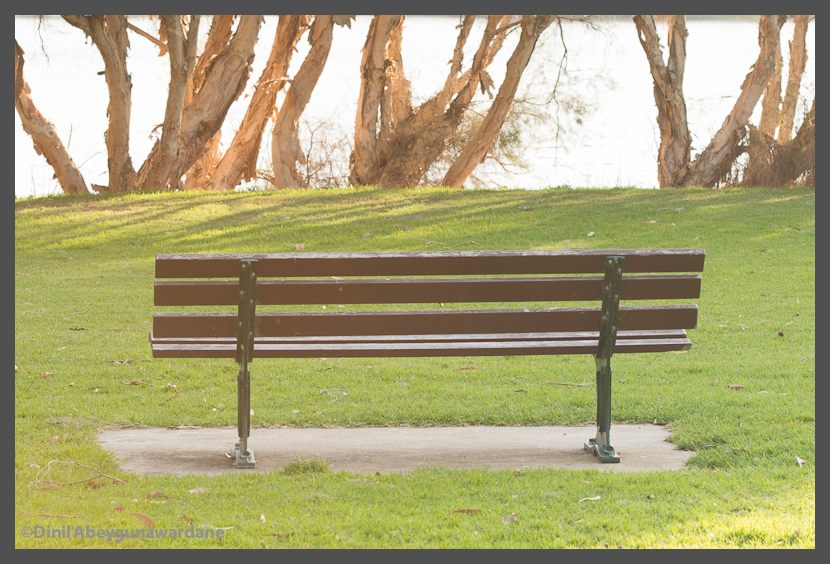
Find the location of a particular element. shade is located at coordinates (627, 217), (716, 273), (88, 321).